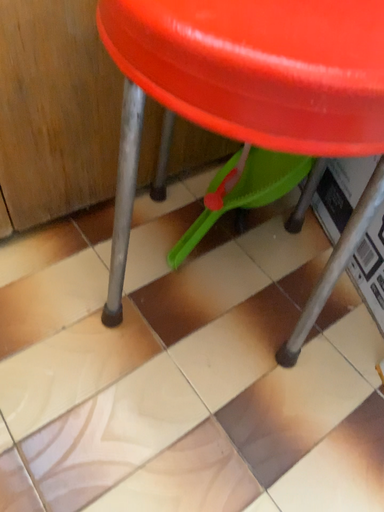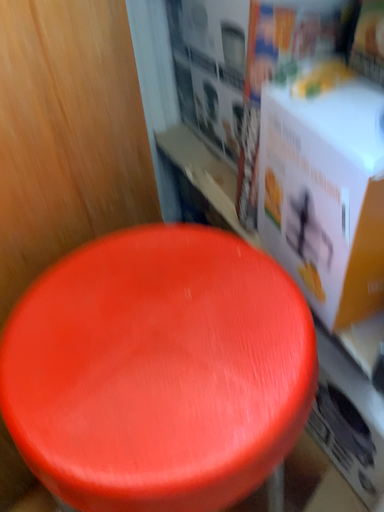
Question: How did the camera likely rotate when shooting the video?

Choices:
 (A) rotated upward
 (B) rotated downward

Answer: (A)